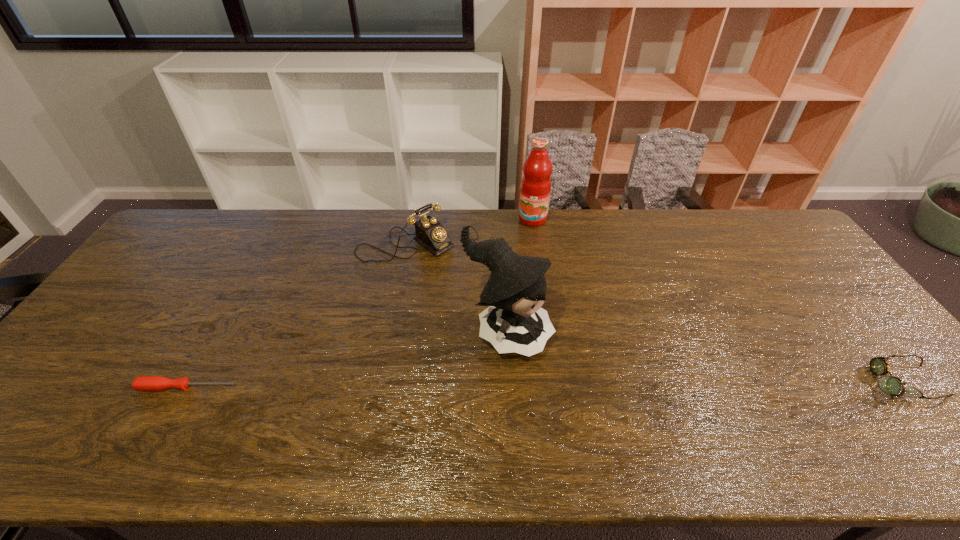
Locate an element on the screen. This screenshot has width=960, height=540. the shortest object is located at coordinates click(x=143, y=383).

Locate an element on the screen. screwdriver is located at coordinates (143, 383).

The width and height of the screenshot is (960, 540). I want to click on the second shortest object, so click(x=892, y=385).

I want to click on the rightmost object, so click(x=892, y=385).

At what (x,y) coordinates should I click in order to perform the action: click on doll. Please return your answer as a coordinate pair (x, y). Looking at the image, I should click on (514, 321).

Identify the location of fruit juice. (536, 184).

You are a GUI agent. You are given a task and a screenshot of the screen. Output one action in this format:
    pyautogui.click(x=<x>, y=<y>)
    Task: Click on the fourth object from right to left
    Image resolution: width=960 pixels, height=540 pixels.
    Given the screenshot: What is the action you would take?
    pyautogui.click(x=430, y=233)

The image size is (960, 540). What are the coordinates of `the third shortest object` in the screenshot? It's located at (430, 233).

The height and width of the screenshot is (540, 960). Identify the location of free location located at the tip of the shortest object. (295, 387).

Locate an element on the screen. free location located at the face of the doll is located at coordinates (606, 389).